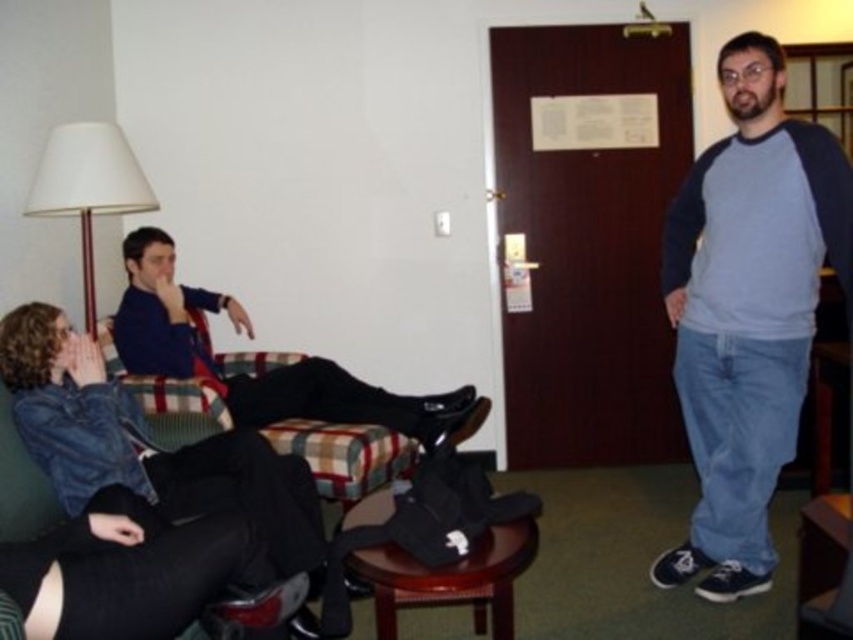
I want to click on denim jacket at lower left, so 144,448.

Does denim jacket at lower left have a smaller size compared to brown wooden stool at lower center?

Incorrect, denim jacket at lower left is not smaller in size than brown wooden stool at lower center.

Describe the element at coordinates (144, 448) in the screenshot. This screenshot has height=640, width=853. I see `denim jacket at lower left` at that location.

Where is `denim jacket at lower left`? The height and width of the screenshot is (640, 853). denim jacket at lower left is located at coordinates (144, 448).

Is point (508, 547) behind point (44, 176)?

No, (508, 547) is closer to viewer.

Is brown wooden stool at lower center taller than white fabric lampshade at upper left?

In fact, brown wooden stool at lower center may be shorter than white fabric lampshade at upper left.

Based on the photo, who is more distant from viewer, [386,515] or [61,196]?

The point [61,196] is behind.

Find the location of a particular element. The image size is (853, 640). brown wooden stool at lower center is located at coordinates (451, 579).

Which is more to the right, blue cotton shirt at right or blue sweater at center?

Positioned to the right is blue cotton shirt at right.

Between blue cotton shirt at right and blue sweater at center, which one is positioned lower?

Positioned lower is blue sweater at center.

The width and height of the screenshot is (853, 640). What do you see at coordinates (747, 310) in the screenshot? I see `blue cotton shirt at right` at bounding box center [747, 310].

Find the location of a particular element. Image resolution: width=853 pixels, height=640 pixels. blue cotton shirt at right is located at coordinates (747, 310).